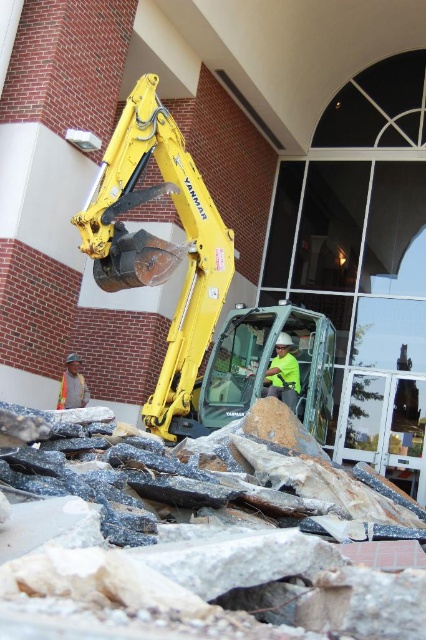
Between point (314, 433) and point (81, 400), which one is positioned in front?

Point (314, 433)

Can you confirm if yellow metallic excavator at center is bigger than orange safety vest at lower left?

Yes.

Identify the location of yellow metallic excavator at center. (189, 282).

Which is behind, point (187, 188) or point (287, 356)?

The point (287, 356) is behind.

Which is behind, point (118, 161) or point (299, 384)?

The point (299, 384) is more distant.

Where is `yellow metallic excavator at center`? yellow metallic excavator at center is located at coordinates click(x=189, y=282).

Who is more forward, (299,385) or (80,385)?

Positioned in front is point (299,385).

Find the location of a particular element. The width and height of the screenshot is (426, 640). neon green safety vest at center is located at coordinates (282, 372).